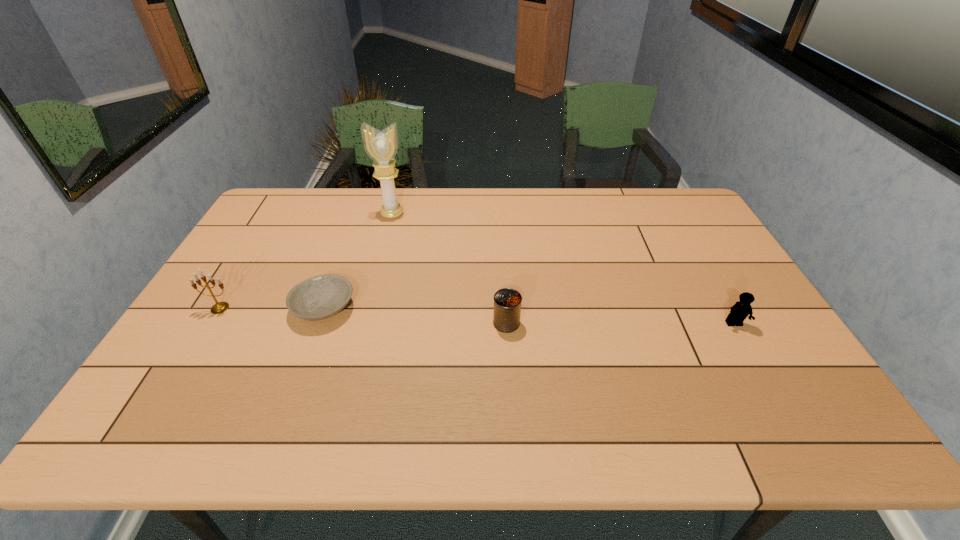
At what (x,y) coordinates should I click in order to perform the action: click on the tallest object. Please return your answer as a coordinate pair (x, y). The height and width of the screenshot is (540, 960). Looking at the image, I should click on pyautogui.click(x=381, y=146).

Locate an element on the screen. The width and height of the screenshot is (960, 540). the farthest object is located at coordinates coord(381,146).

Find the location of a particular element. The height and width of the screenshot is (540, 960). the leftmost object is located at coordinates (218, 308).

The height and width of the screenshot is (540, 960). Identify the location of the fourth shortest object. (218, 308).

This screenshot has height=540, width=960. In order to click on can in this screenshot , I will do `click(507, 302)`.

The width and height of the screenshot is (960, 540). Identify the location of Lego. (741, 309).

You are a GUI agent. You are given a task and a screenshot of the screen. Output one action in this format:
    pyautogui.click(x=<x>, y=<y>)
    Task: Click on the shortest object
    
    Given the screenshot: What is the action you would take?
    pyautogui.click(x=320, y=297)

This screenshot has width=960, height=540. What are the coordinates of `vacant space located on the front-facing side of the farthest object` in the screenshot? It's located at (376, 276).

At what (x,y) coordinates should I click in order to perform the action: click on free location located on the front of the second tallest object. Please return your answer as a coordinate pair (x, y). The width and height of the screenshot is (960, 540). Looking at the image, I should click on (193, 352).

You are a GUI agent. You are given a task and a screenshot of the screen. Output one action in this format:
    pyautogui.click(x=<x>, y=<y>)
    Task: Click on the vacant space situated on the back of the can
    The width and height of the screenshot is (960, 540).
    Given the screenshot: What is the action you would take?
    pyautogui.click(x=502, y=244)